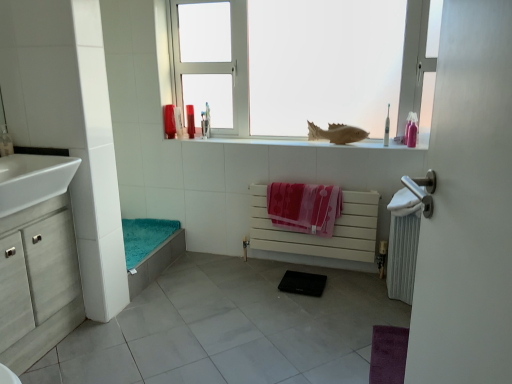
Find the location of `vacant space that's between white matte radiator at center, marked as the 2th radiator in a right-to-left arrangement, and white metallic radiator at right, acting as the second radiator starting from the left`. vacant space that's between white matte radiator at center, marked as the 2th radiator in a right-to-left arrangement, and white metallic radiator at right, acting as the second radiator starting from the left is located at coordinates (343, 278).